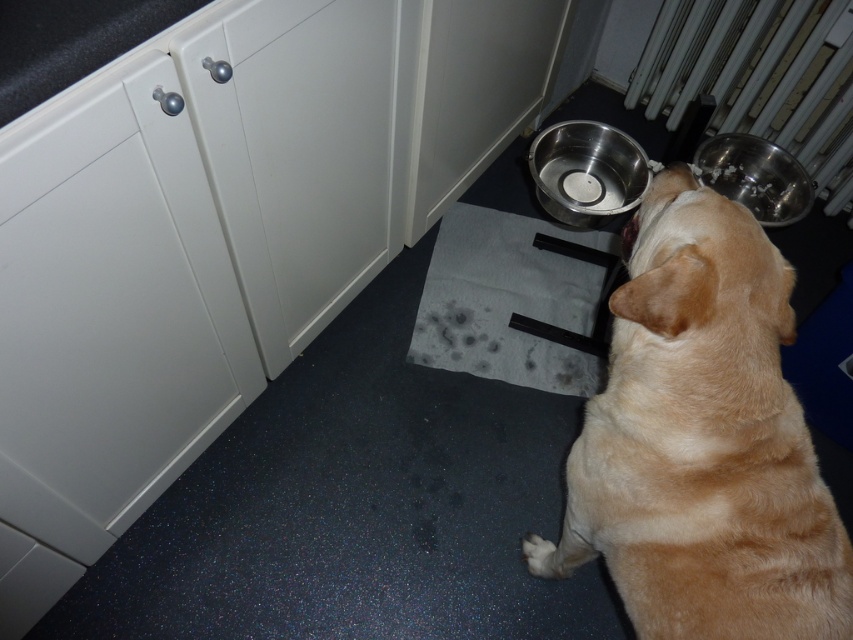
You are standing in the kitchen and want to place a small plant between the two points marked as point (744, 426) and point (759, 32). Since the plant needs to be closer to the dog, which point should you choose?

You should choose point (744, 426) because it is closer to the viewer, which is where the dog is located.

You are a delivery robot that needs to drop off a package at the point marked by coordinates point (801, 493). The robot is currently positioned at the camera location. The robot has a maximum reach distance of 30 inches. Can the robot deliver the package without moving?

The point marked by coordinates point (801, 493) is 28.27 inches away from the camera. Since the robot has a maximum reach distance of 30 inches, it can deliver the package without moving.

You are a robotic dog feeder. You need to place a new bowl at a position that is 0.1 units to the right and 0.05 units above the light brown fur at center. What are the coordinates of the new bowl?

The coordinates of the new bowl would be calculated by adding 0.1 to the x coordinate and 0.05 to the y coordinate of the light brown fur at center. The original coordinates are at point (701, 440). Adding 0.1 to the x gives 0.788, and adding 0.05 to the y gives 0.874. Therefore, the new bowl should be placed at coordinates (745, 504).